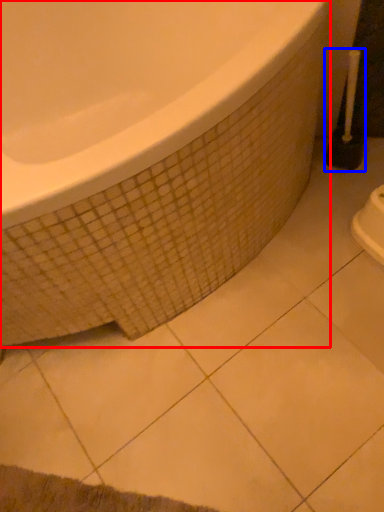
Question: Which of the following is the farthest to the observer, bathtub (highlighted by a red box) or brush (highlighted by a blue box)?

Choices:
 (A) bathtub
 (B) brush

Answer: (B)